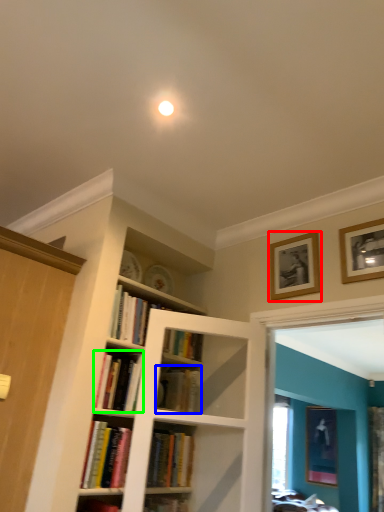
Question: Which object is the closest to the picture frame (highlighted by a red box)? Choose among these: book (highlighted by a blue box) or book (highlighted by a green box).

Choices:
 (A) book
 (B) book

Answer: (A)